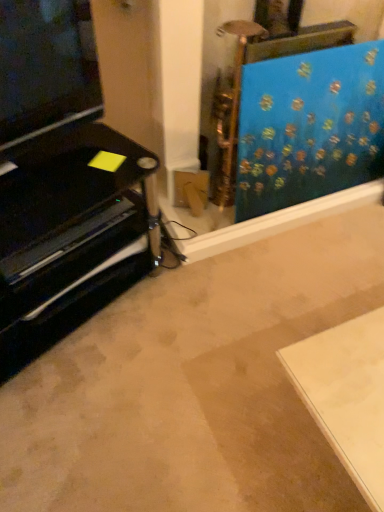
Where is `free location in front of black glossy entertainment unit at left`? Image resolution: width=384 pixels, height=512 pixels. free location in front of black glossy entertainment unit at left is located at coordinates (92, 420).